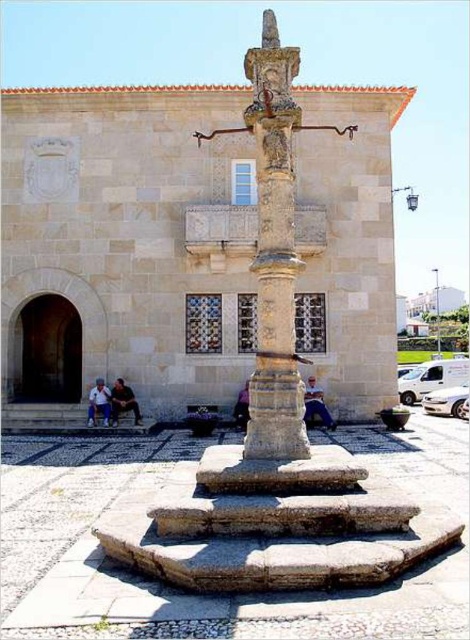
You are an interior designer observing the scene. You need to determine which object, the light blue denim jeans at lower left or the dark purple fabric at center, requires more space for storage. Based on their sizes, which one should you allocate more storage space for?

The light blue denim jeans at lower left is bigger than the dark purple fabric at center, so you should allocate more storage space for the light blue denim jeans at lower left.

You are a tour guide explaining the historical site to visitors. You mention both the stone column at center and the smooth stone totem pole at center. A visitor asks if they are touching each other. What do you tell them?

The stone column at center is 20.11 inches away from the smooth stone totem pole at center, so they are not touching each other.